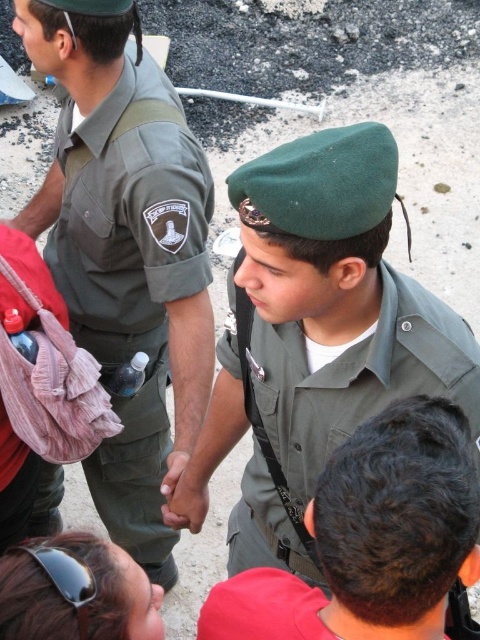
Question: Can you confirm if green fabric uniform at left is positioned to the left of green matte uniform at center?

Choices:
 (A) yes
 (B) no

Answer: (A)

Question: Does green fabric uniform at left have a larger size compared to green matte uniform at center?

Choices:
 (A) yes
 (B) no

Answer: (A)

Question: Is green fabric uniform at left in front of green matte uniform at center?

Choices:
 (A) yes
 (B) no

Answer: (B)

Question: Which of the following is the closest to the observer?

Choices:
 (A) green fabric uniform at left
 (B) green matte uniform at center

Answer: (B)